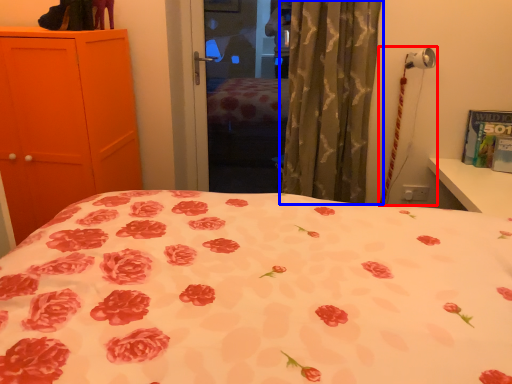
Question: Which point is further to the camera, table lamp (highlighted by a red box) or curtain (highlighted by a blue box)?

Choices:
 (A) table lamp
 (B) curtain

Answer: (A)